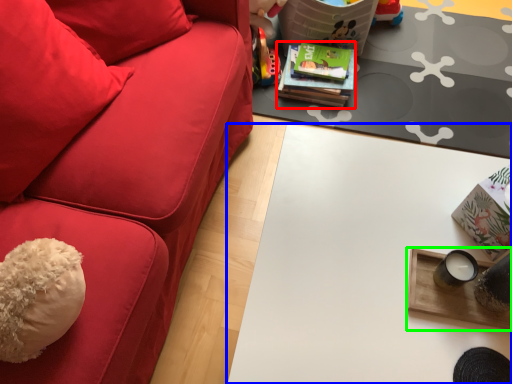
Question: Considering the real-world distances, which object is closest to magazine (highlighted by a red box)? table (highlighted by a blue box) or table (highlighted by a green box).

Choices:
 (A) table
 (B) table

Answer: (A)